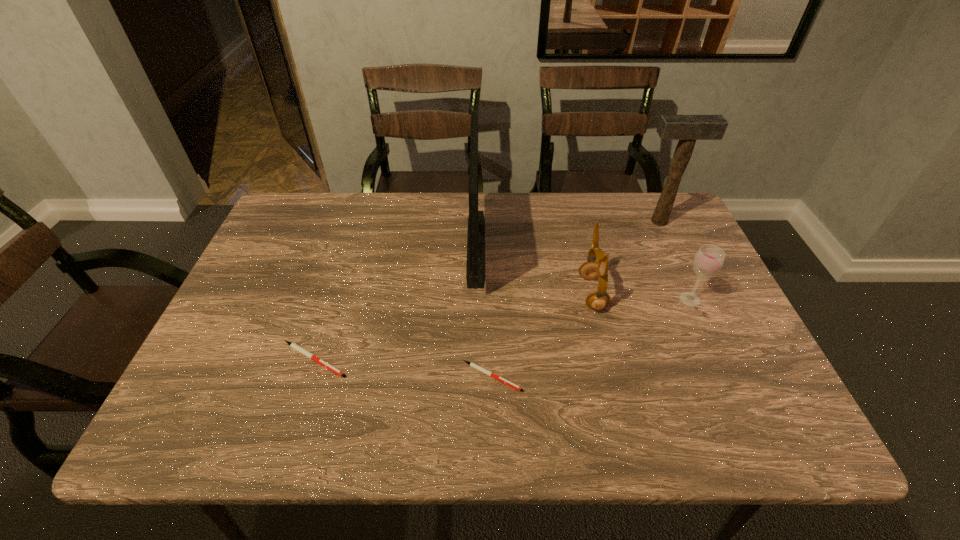
I want to click on vacant space located on the clicker of the shorter pen, so click(x=592, y=376).

Identify the location of vacant position located on the front of the mallet. This screenshot has height=540, width=960. (689, 287).

This screenshot has width=960, height=540. I want to click on blank space located 0.220m on the front-facing side of the monitor, so (x=563, y=246).

This screenshot has height=540, width=960. Find the location of `vacant point located 0.070m on the left of the third shortest object`. vacant point located 0.070m on the left of the third shortest object is located at coordinates (650, 299).

Locate an element on the screen. vacant space situated 0.340m on the front-facing side of the third object from right to left is located at coordinates (446, 293).

This screenshot has height=540, width=960. In order to click on free space located on the front-facing side of the third object from right to left in this screenshot , I will do `click(431, 293)`.

This screenshot has height=540, width=960. I want to click on vacant region located 0.350m on the front-facing side of the third object from right to left, so click(x=443, y=293).

The width and height of the screenshot is (960, 540). I want to click on mallet at the far edge, so click(x=687, y=129).

Where is `monitor positioned at the far edge`? The width and height of the screenshot is (960, 540). monitor positioned at the far edge is located at coordinates pos(475,269).

Locate an element on the screen. The width and height of the screenshot is (960, 540). mallet located in the right edge section of the desktop is located at coordinates (687, 129).